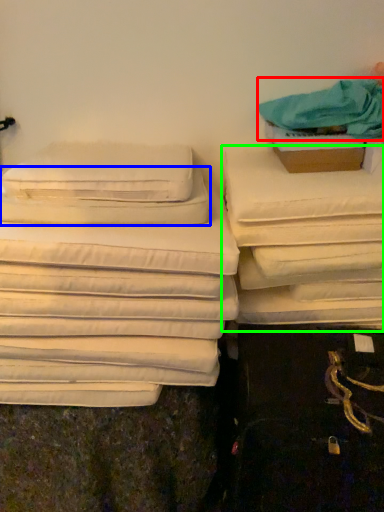
Question: Considering the real-world distances, which object is farthest from cloth (highlighted by a red box)? pillow (highlighted by a blue box) or furniture (highlighted by a green box)?

Choices:
 (A) pillow
 (B) furniture

Answer: (A)